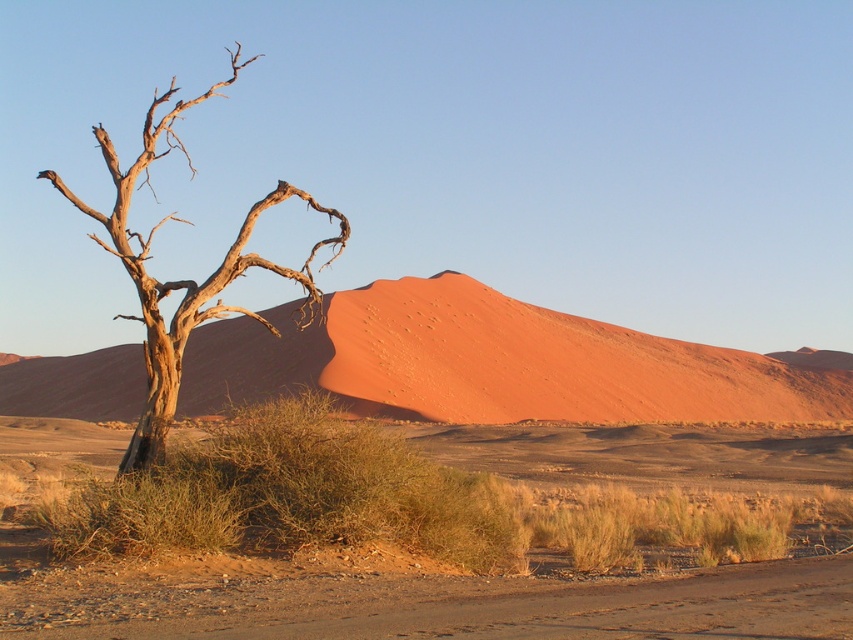
You are standing in the desert landscape looking at the scene. There are two points marked in the image at coordinates point (61, 508) and point (161, 433). Which point is closer to you?

Point (61, 508) is closer to the viewer than point (161, 433).